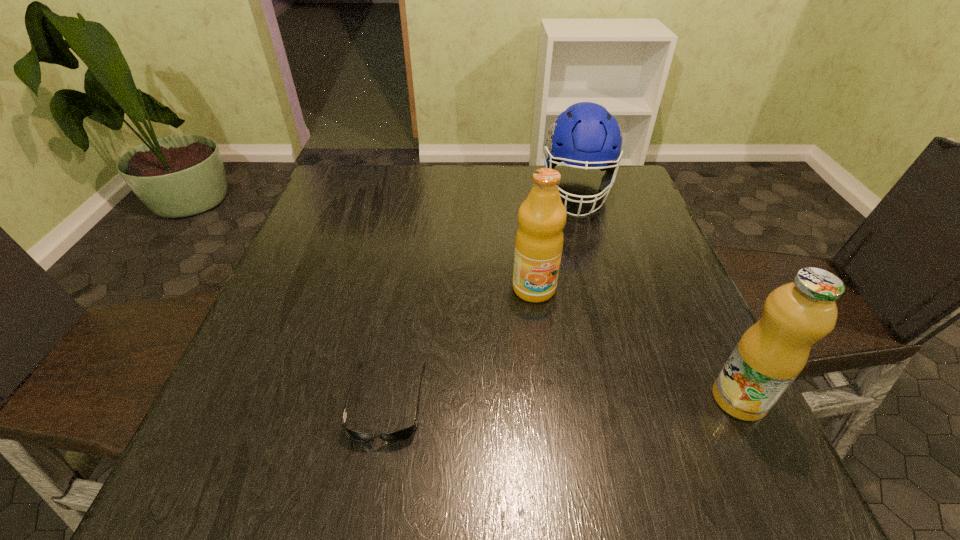
This screenshot has height=540, width=960. Find the location of `vacant space that's between the farthest object and the shortest object`. vacant space that's between the farthest object and the shortest object is located at coordinates (481, 297).

Find the location of a particular element. free space between the rightmost object and the sunglasses is located at coordinates click(x=563, y=400).

At what (x,y) coordinates should I click in order to perform the action: click on vacant area that lies between the right fruit juice and the shortest object. Please return your answer as a coordinate pair (x, y). The height and width of the screenshot is (540, 960). Looking at the image, I should click on (563, 400).

You are a GUI agent. You are given a task and a screenshot of the screen. Output one action in this format:
    pyautogui.click(x=<x>, y=<y>)
    Task: Click on the vacant area that lies between the third nearest object and the nearer fruit juice
    The image size is (960, 540).
    Given the screenshot: What is the action you would take?
    pyautogui.click(x=636, y=343)

This screenshot has width=960, height=540. Find the location of `blank region between the sunglasses and the second shortest object`. blank region between the sunglasses and the second shortest object is located at coordinates (481, 297).

Image resolution: width=960 pixels, height=540 pixels. What are the coordinates of `free space between the sunglasses and the right fruit juice` in the screenshot? It's located at (563, 400).

Find the location of `free space between the left fruit juice and the right fruit juice`. free space between the left fruit juice and the right fruit juice is located at coordinates (636, 343).

Select which object appears as the closest to the nearer fruit juice. Please provide its 2D coordinates. Your answer should be formatted as a tuple, i.e. [(x, y)], where the tuple contains the x and y coordinates of a point satisfying the conditions above.

[(539, 240)]

At what (x,y) coordinates should I click in order to perform the action: click on the closest object to the nearer fruit juice. Please return your answer as a coordinate pair (x, y). This screenshot has height=540, width=960. Looking at the image, I should click on (539, 240).

Identify the location of free point that satisfies the following two spatial constraints: 1. on the back side of the farthest object; 2. on the left side of the second farthest object. Image resolution: width=960 pixels, height=540 pixels. (522, 193).